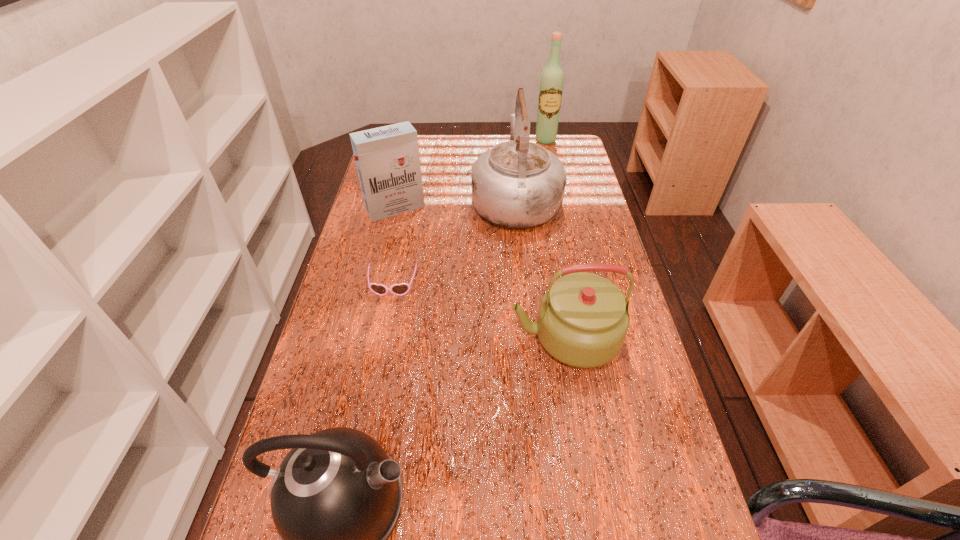
Identify which object is the fourth nearest to the wine bottle. Please provide its 2D coordinates. Your answer should be formatted as a tuple, i.e. [(x, y)], where the tuple contains the x and y coordinates of a point satisfying the conditions above.

[(583, 319)]

I want to click on object that ranks as the second closest to the farthest kettle, so click(552, 78).

Find the location of a particular element. The height and width of the screenshot is (540, 960). kettle object that ranks as the second closest to the second farthest kettle is located at coordinates pyautogui.click(x=517, y=184).

Identify which kettle is the third closest to the cigarette case. Please provide its 2D coordinates. Your answer should be formatted as a tuple, i.e. [(x, y)], where the tuple contains the x and y coordinates of a point satisfying the conditions above.

[(336, 498)]

The width and height of the screenshot is (960, 540). I want to click on free space that satisfies the following two spatial constraints: 1. on the front-facing side of the farthest object; 2. at the spout of the second nearest kettle, so click(588, 337).